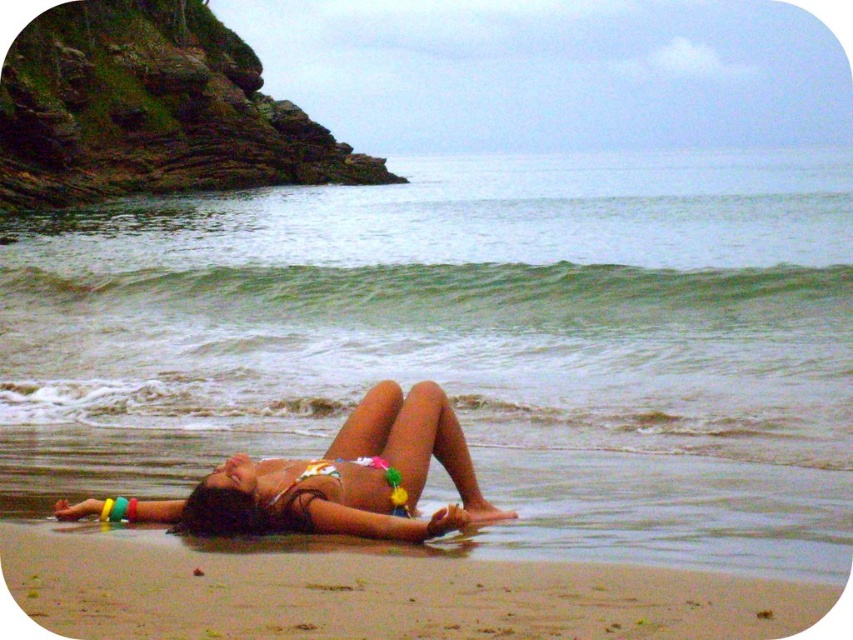
Based on the photo, is smooth tan sand at lower center wider than white bikini at center?

Yes.

Locate an element on the screen. This screenshot has height=640, width=853. smooth tan sand at lower center is located at coordinates (376, 593).

Which is in front, point (358, 605) or point (178, 524)?

Positioned in front is point (358, 605).

You are a GUI agent. You are given a task and a screenshot of the screen. Output one action in this format:
    pyautogui.click(x=<x>, y=<y>)
    Task: Click on the smooth tan sand at lower center
    
    Given the screenshot: What is the action you would take?
    pyautogui.click(x=376, y=593)